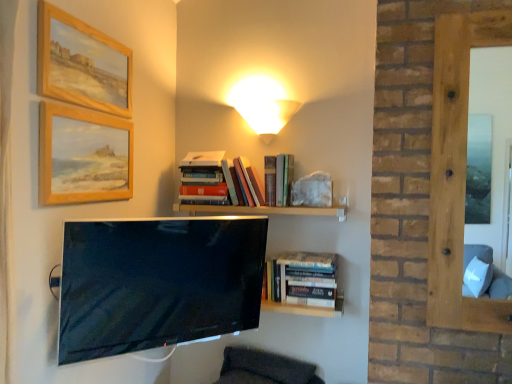
This screenshot has height=384, width=512. In order to click on vacant space situated above matte yellow glass table lamp at upper center (from a real-world perspective) in this screenshot , I will do `click(259, 94)`.